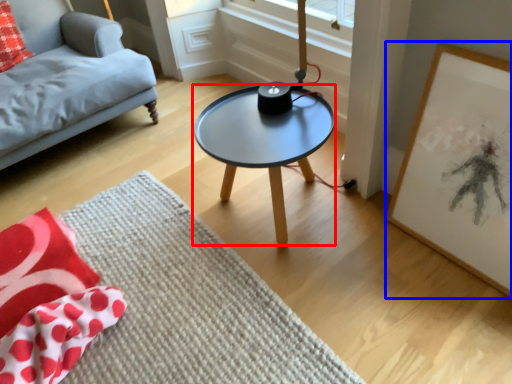
Question: Which object is closer to the camera taking this photo, coffee table (highlighted by a red box) or picture frame (highlighted by a blue box)?

Choices:
 (A) coffee table
 (B) picture frame

Answer: (B)